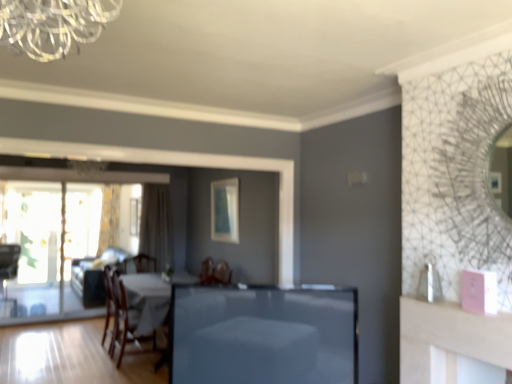
Question: Is beige fabric curtain at left, arranged as the 2th curtain when viewed from the left, to the right of smooth glass table at center from the viewer's perspective?

Choices:
 (A) no
 (B) yes

Answer: (A)

Question: Are beige fabric curtain at left, which is the 2th curtain from back to front, and smooth glass table at center located far from each other?

Choices:
 (A) yes
 (B) no

Answer: (A)

Question: Is beige fabric curtain at left, arranged as the 2th curtain when viewed from the left, thinner than smooth glass table at center?

Choices:
 (A) no
 (B) yes

Answer: (A)

Question: Does beige fabric curtain at left, placed as the first curtain when sorted from right to left, touch smooth glass table at center?

Choices:
 (A) no
 (B) yes

Answer: (A)

Question: Does beige fabric curtain at left, which is the 2th curtain from back to front, lie behind smooth glass table at center?

Choices:
 (A) yes
 (B) no

Answer: (A)

Question: From a real-world perspective, relative to velvet beige couch at center, is wooden chair at lower left, marked as the 2th chair in a left-to-right arrangement, vertically above or below?

Choices:
 (A) below
 (B) above

Answer: (B)

Question: In the image, is wooden chair at lower left, positioned as the 2th chair in back-to-front order, positioned in front of or behind velvet beige couch at center?

Choices:
 (A) behind
 (B) front

Answer: (B)

Question: Is wooden chair at lower left, the first chair positioned from the right, bigger or smaller than velvet beige couch at center?

Choices:
 (A) big
 (B) small

Answer: (B)

Question: Choose the correct answer: Is wooden chair at lower left, positioned as the 2th chair in back-to-front order, inside velvet beige couch at center or outside it?

Choices:
 (A) inside
 (B) outside

Answer: (B)

Question: From a real-world perspective, is matte blue picture frame at center, the first picture frame in the front-to-back sequence, positioned above or below wooden chair at left, the second chair in the front-to-back sequence?

Choices:
 (A) above
 (B) below

Answer: (A)

Question: Is matte blue picture frame at center, the 1th picture frame when ordered from right to left, taller or shorter than wooden chair at left, marked as the first chair in a left-to-right arrangement?

Choices:
 (A) short
 (B) tall

Answer: (A)

Question: Choose the correct answer: Is matte blue picture frame at center, the second picture frame positioned from the back, inside wooden chair at left, which appears as the 1th chair when viewed from the back, or outside it?

Choices:
 (A) outside
 (B) inside

Answer: (A)

Question: Looking at their shapes, would you say matte blue picture frame at center, the 1th picture frame when ordered from right to left, is wider or thinner than wooden chair at left, which appears as the 1th chair when viewed from the back?

Choices:
 (A) wide
 (B) thin

Answer: (B)

Question: In terms of height, does matte blue picture frame at center, the second picture frame positioned from the back, look taller or shorter compared to beige fabric curtain at left, placed as the first curtain when sorted from right to left?

Choices:
 (A) short
 (B) tall

Answer: (A)

Question: Is matte blue picture frame at center, placed as the 2th picture frame when sorted from left to right, inside or outside of beige fabric curtain at left, placed as the first curtain when sorted from right to left?

Choices:
 (A) outside
 (B) inside

Answer: (A)